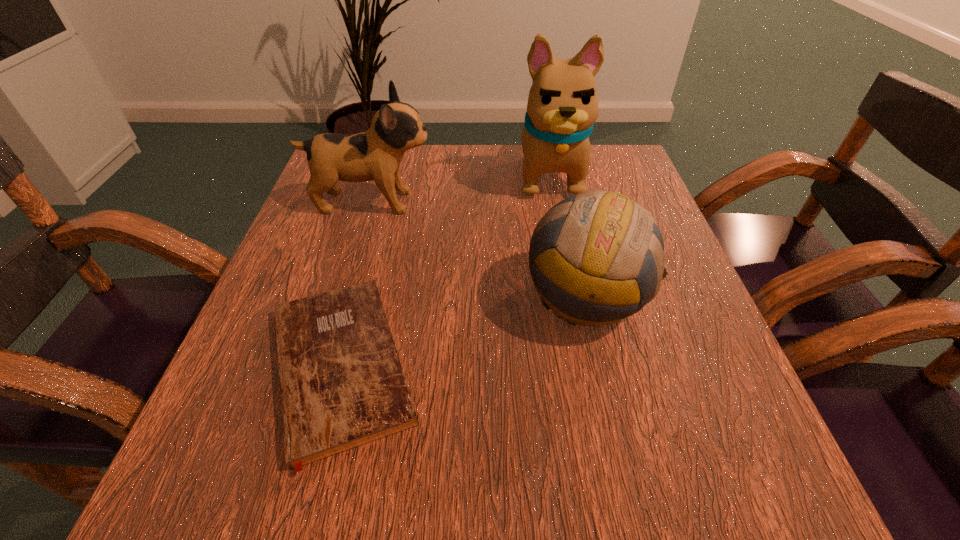
Where is `object situated at the near edge`? Image resolution: width=960 pixels, height=540 pixels. object situated at the near edge is located at coordinates (342, 385).

Identify the location of puppy at the left edge. (376, 154).

The image size is (960, 540). In order to click on Bible present at the left edge in this screenshot , I will do `click(342, 385)`.

In order to click on puppy positioned at the right edge in this screenshot , I will do click(562, 107).

At what (x,y) coordinates should I click in order to perform the action: click on volleyball that is at the right edge. Please return your answer as a coordinate pair (x, y). The height and width of the screenshot is (540, 960). Looking at the image, I should click on (605, 234).

Find the location of `object that is at the far left corner`. object that is at the far left corner is located at coordinates (376, 154).

At what (x,y) coordinates should I click in order to perform the action: click on object that is at the near left corner. Please return your answer as a coordinate pair (x, y). Looking at the image, I should click on (342, 385).

Image resolution: width=960 pixels, height=540 pixels. I want to click on object that is at the far right corner, so click(x=562, y=107).

Where is `free spot at the far edge of the desktop`? free spot at the far edge of the desktop is located at coordinates (502, 168).

This screenshot has height=540, width=960. I want to click on vacant space at the near edge of the desktop, so click(441, 505).